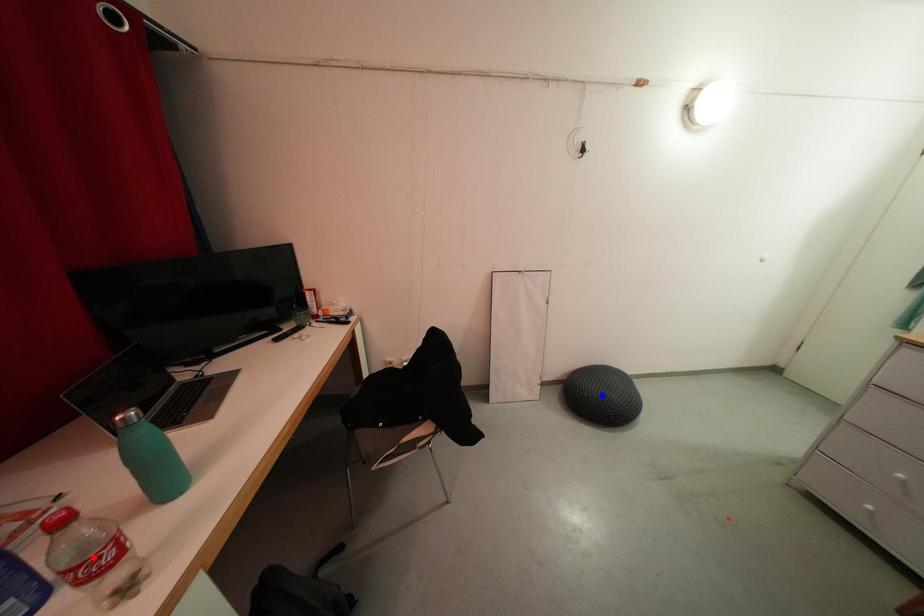
Question: Which of the two points in the image is closer to the camera?

Choices:
 (A) Blue point is closer.
 (B) Red point is closer.

Answer: (B)